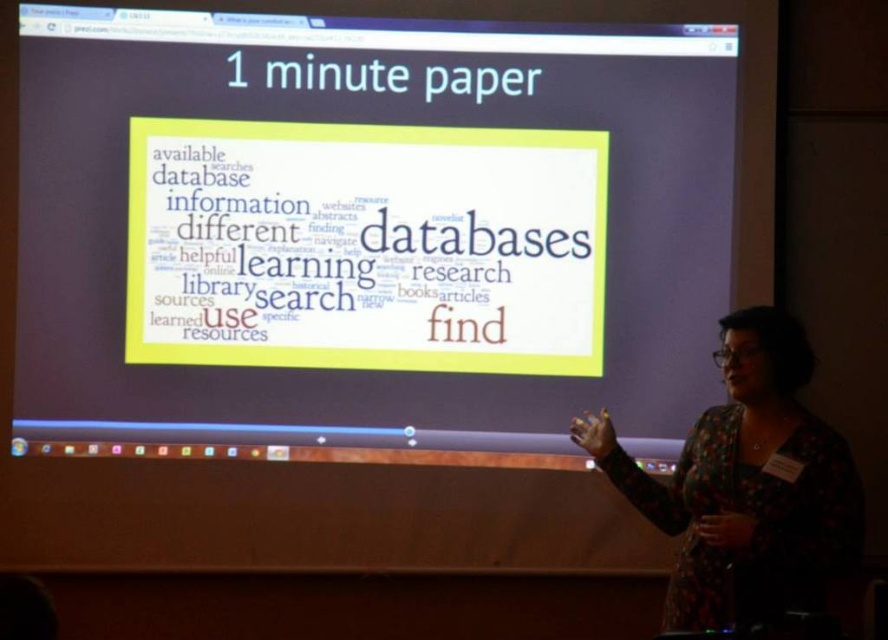
Can you confirm if white paper at center is positioned to the right of floral-patterned blouse at right?

No, white paper at center is not to the right of floral-patterned blouse at right.

Between point (524, 51) and point (646, 513), which one is positioned behind?

Positioned behind is point (524, 51).

This screenshot has height=640, width=888. What are the coordinates of `white paper at center` in the screenshot? It's located at (367, 228).